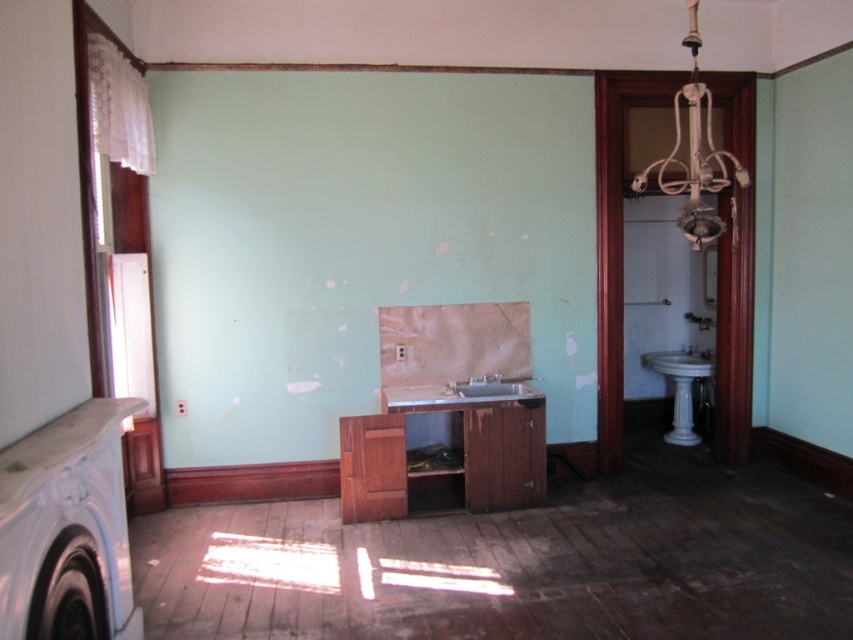
Question: Which of the following is the closest to the observer?

Choices:
 (A) (688, 440)
 (B) (708, 234)
 (C) (500, 378)

Answer: (B)

Question: Does white matte chandelier at upper right appear over white marble pedestal at right?

Choices:
 (A) yes
 (B) no

Answer: (A)

Question: Is white matte chandelier at upper right to the right of matte white sink at center from the viewer's perspective?

Choices:
 (A) yes
 (B) no

Answer: (A)

Question: Considering the real-world distances, which object is closest to the white matte chandelier at upper right?

Choices:
 (A) wooden cabinet at center
 (B) white marble pedestal at right

Answer: (A)

Question: Does wooden cabinet at center have a greater width compared to white matte chandelier at upper right?

Choices:
 (A) yes
 (B) no

Answer: (A)

Question: Which of the following is the farthest from the observer?

Choices:
 (A) (463, 388)
 (B) (512, 420)

Answer: (A)